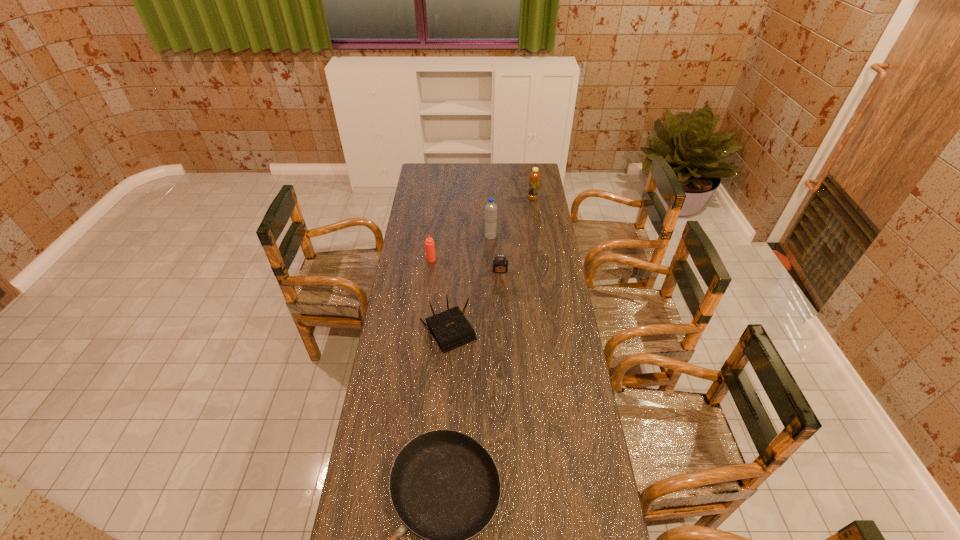
Locate an element on the screen. The height and width of the screenshot is (540, 960). blank space located 0.370m on the back of the Tabasco sauce is located at coordinates (437, 212).

Locate an element on the screen. vacant region located on the front of the padlock near the keyhole is located at coordinates (502, 312).

Where is `free spot located 0.130m on the back of the second nearest object`? The image size is (960, 540). free spot located 0.130m on the back of the second nearest object is located at coordinates (452, 288).

The image size is (960, 540). What are the coordinates of `Tabasco sauce located in the left edge section of the desktop` in the screenshot? It's located at (429, 243).

Image resolution: width=960 pixels, height=540 pixels. In order to click on router at the left edge in this screenshot , I will do `click(450, 329)`.

This screenshot has height=540, width=960. I want to click on object at the right edge, so click(534, 177).

You are a GUI agent. You are given a task and a screenshot of the screen. Output one action in this format:
    pyautogui.click(x=<x>, y=<y>)
    Task: Click on the free space at the far edge of the desktop
    The height and width of the screenshot is (540, 960).
    Given the screenshot: What is the action you would take?
    pyautogui.click(x=490, y=166)

In the image, there is a desktop. Where is `free space at the left edge`? This screenshot has height=540, width=960. free space at the left edge is located at coordinates (410, 429).

At what (x,y) coordinates should I click in order to perform the action: click on vacant space at the right edge of the desktop. Please return your answer as a coordinate pair (x, y). The height and width of the screenshot is (540, 960). Looking at the image, I should click on (536, 264).

The image size is (960, 540). What are the coordinates of `free space at the far right corner of the desktop` in the screenshot? It's located at (523, 173).